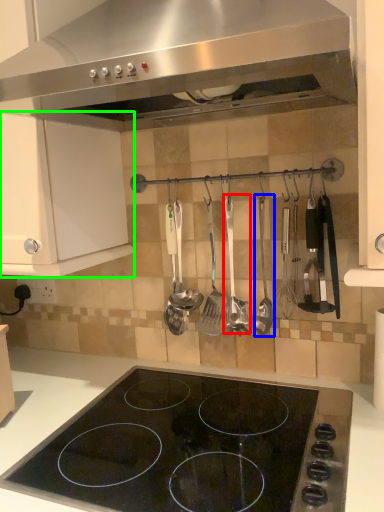
Question: Based on their relative distances, which object is nearer to silverware (highlighted by a red box)? Choose from silverware (highlighted by a blue box) and cabinetry (highlighted by a green box).

Choices:
 (A) silverware
 (B) cabinetry

Answer: (A)